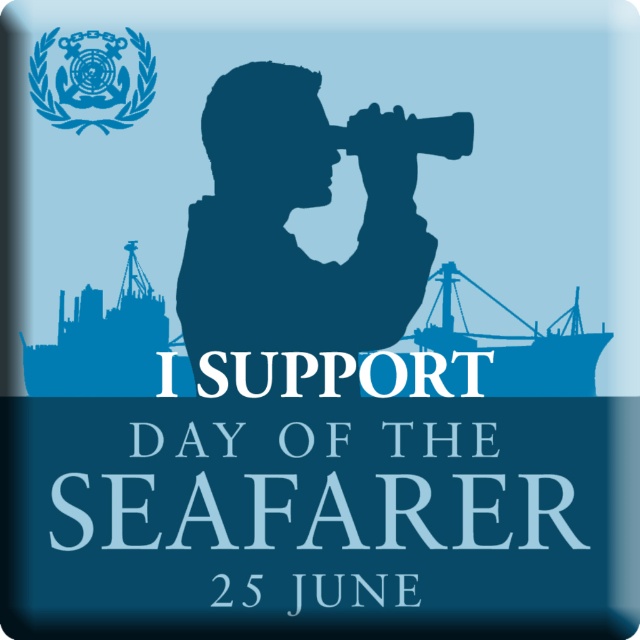
Question: Which object is closer to the camera taking this photo?

Choices:
 (A) blue matte ship at center
 (B) matte blue silhouette at center
 (C) blue matte ship at lower left

Answer: (B)

Question: Is matte blue silhouette at center to the left of blue matte ship at center from the viewer's perspective?

Choices:
 (A) no
 (B) yes

Answer: (B)

Question: From the image, what is the correct spatial relationship of blue matte ship at lower left in relation to matte black telescope at upper center?

Choices:
 (A) below
 (B) above

Answer: (A)

Question: Considering the real-world distances, which object is closest to the blue matte ship at center?

Choices:
 (A) matte black telescope at upper center
 (B) blue matte ship at lower left

Answer: (A)

Question: Which point is closer to the camera?

Choices:
 (A) (378, 136)
 (B) (88, 323)

Answer: (A)

Question: Is matte blue silhouette at center thinner than blue matte ship at center?

Choices:
 (A) yes
 (B) no

Answer: (B)